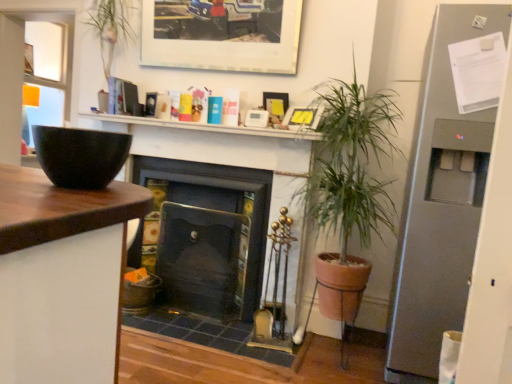
This screenshot has width=512, height=384. Describe the element at coordinates (303, 117) in the screenshot. I see `yellow paper picture frame at upper center, positioned as the 1th picture frame in bottom-to-top order` at that location.

Where is `satin silver fridge at right`? satin silver fridge at right is located at coordinates (441, 202).

Locate an element on the screen. matte white picture frame at upper center, which is counted as the 1th picture frame, starting from the top is located at coordinates (221, 36).

Between point (291, 304) and point (316, 133), which one is positioned behind?

The point (291, 304) is farther from the camera.

Is white matte shelf at upper center at the back of dark gray stone fireplace at center, arranged as the second fireplace when viewed from the left?

No, dark gray stone fireplace at center, arranged as the second fireplace when viewed from the left, is not facing away from white matte shelf at upper center.

Is dark gray stone fireplace at center, which is counted as the first fireplace, starting from the right, taller than white matte shelf at upper center?

Indeed, dark gray stone fireplace at center, which is counted as the first fireplace, starting from the right, has a greater height compared to white matte shelf at upper center.

From the image's perspective, is dark gray stone fireplace at center, which is counted as the first fireplace, starting from the right, positioned above or below white matte shelf at upper center?

Clearly, from the image's perspective, dark gray stone fireplace at center, which is counted as the first fireplace, starting from the right, is below white matte shelf at upper center.

Is satin silver fridge at right closer to camera compared to yellow paper picture frame at upper center, positioned as the 1th picture frame in bottom-to-top order?

Yes, the depth of satin silver fridge at right is less than that of yellow paper picture frame at upper center, positioned as the 1th picture frame in bottom-to-top order.

Considering the points (441, 286) and (297, 117), which point is in front, point (441, 286) or point (297, 117)?

The point (441, 286) is closer.

This screenshot has height=384, width=512. Find the location of `houseplant lying below the white matte shelf at upper center (from the image's perspective)`. houseplant lying below the white matte shelf at upper center (from the image's perspective) is located at coordinates (350, 163).

Which of these two, green leafy plant at center or white matte shelf at upper center, is smaller?

With smaller size is white matte shelf at upper center.

Is green leafy plant at center to the right of white matte shelf at upper center from the viewer's perspective?

Indeed, green leafy plant at center is positioned on the right side of white matte shelf at upper center.

Is white matte shelf at upper center at the back of green leafy plant at center?

No.

In the scene shown: Considering the relative sizes of matte black fireplace at center, positioned as the first fireplace in left-to-right order, and matte black bowl at left in the image provided, is matte black fireplace at center, positioned as the first fireplace in left-to-right order, taller than matte black bowl at left?

Yes, matte black fireplace at center, positioned as the first fireplace in left-to-right order, is taller than matte black bowl at left.

From the image's perspective, who appears lower, matte black fireplace at center, the 2th fireplace viewed from the right, or matte black bowl at left?

matte black fireplace at center, the 2th fireplace viewed from the right, appears lower in the image.

Are matte black fireplace at center, the 2th fireplace viewed from the right, and matte black bowl at left located far from each other?

matte black fireplace at center, the 2th fireplace viewed from the right, is positioned a significant distance from matte black bowl at left.

From the picture: Can you confirm if white matte shelf at upper center is positioned to the right of yellow paper picture frame at upper center, arranged as the 3th picture frame when viewed from the top?

In fact, white matte shelf at upper center is to the left of yellow paper picture frame at upper center, arranged as the 3th picture frame when viewed from the top.

From the image's perspective, is white matte shelf at upper center positioned above or below yellow paper picture frame at upper center, positioned as the 1th picture frame in bottom-to-top order?

Clearly, from the image's perspective, white matte shelf at upper center is below yellow paper picture frame at upper center, positioned as the 1th picture frame in bottom-to-top order.

Is white matte shelf at upper center not within yellow paper picture frame at upper center, arranged as the 3th picture frame when viewed from the top?

Yes.

Based on the photo, considering the sizes of objects white matte shelf at upper center and yellow paper picture frame at upper center, arranged as the 3th picture frame when viewed from the top, in the image provided, who is wider, white matte shelf at upper center or yellow paper picture frame at upper center, arranged as the 3th picture frame when viewed from the top,?

white matte shelf at upper center is wider.

Between satin silver fridge at right and matte black bowl at left, which one has larger size?

Bigger between the two is satin silver fridge at right.

From a real-world perspective, between satin silver fridge at right and matte black bowl at left, who is vertically lower?

satin silver fridge at right is physically lower.

Is satin silver fridge at right facing away from matte black bowl at left?

That's not correct — satin silver fridge at right is not looking away from matte black bowl at left.

Is satin silver fridge at right positioned before matte black bowl at left?

No, it is not.

From a real-world perspective, is matte black fireplace at center, the 2th fireplace viewed from the right, located higher than matte white picture frame at upper center, which is counted as the 1th picture frame, starting from the top?

No.

How different are the orientations of matte black fireplace at center, the 2th fireplace viewed from the right, and matte white picture frame at upper center, placed as the third picture frame when sorted from bottom to top, in degrees?

0.193 degrees.

Does matte black fireplace at center, positioned as the first fireplace in left-to-right order, have a lesser height compared to matte white picture frame at upper center, placed as the third picture frame when sorted from bottom to top?

No.

Could you tell me if matte black fireplace at center, positioned as the first fireplace in left-to-right order, is facing matte white picture frame at upper center, placed as the third picture frame when sorted from bottom to top?

No, matte black fireplace at center, positioned as the first fireplace in left-to-right order, is not turned towards matte white picture frame at upper center, placed as the third picture frame when sorted from bottom to top.

I want to click on shelf above the dark gray stone fireplace at center, which is counted as the first fireplace, starting from the right (from a real-world perspective), so click(x=205, y=127).

Where is `fridge below the yellow paper picture frame at upper center, positioned as the 1th picture frame in bottom-to-top order (from the image's perspective)`? The width and height of the screenshot is (512, 384). fridge below the yellow paper picture frame at upper center, positioned as the 1th picture frame in bottom-to-top order (from the image's perspective) is located at coordinates (441, 202).

Based on their spatial positions, is matte yellow picture frame at upper center, which is counted as the 2th picture frame, starting from the bottom, or matte white picture frame at upper center, placed as the third picture frame when sorted from bottom to top, closer to white matte shelf at upper center?

matte yellow picture frame at upper center, which is counted as the 2th picture frame, starting from the bottom, is closer to white matte shelf at upper center.

Considering their positions, is yellow paper picture frame at upper center, positioned as the 1th picture frame in bottom-to-top order, positioned closer to matte black bowl at left than matte white picture frame at upper center, which is counted as the 1th picture frame, starting from the top?

The object closer to matte black bowl at left is yellow paper picture frame at upper center, positioned as the 1th picture frame in bottom-to-top order.

Which object lies nearer to the anchor point matte black bowl at left, white matte shelf at upper center or dark gray stone fireplace at center, which is counted as the first fireplace, starting from the right?

white matte shelf at upper center is positioned closer to the anchor matte black bowl at left.

Considering their positions, is satin silver fridge at right positioned closer to matte black bowl at left than dark gray stone fireplace at center, arranged as the second fireplace when viewed from the left?

satin silver fridge at right is closer to matte black bowl at left.

Estimate the real-world distances between objects in this image. Which object is closer to satin silver fridge at right, white matte shelf at upper center or matte yellow picture frame at upper center, which is counted as the 2th picture frame, starting from the bottom?

white matte shelf at upper center is positioned closer to the anchor satin silver fridge at right.

Looking at the image, which one is located closer to satin silver fridge at right, matte black bowl at left or yellow paper picture frame at upper center, arranged as the 3th picture frame when viewed from the top?

Based on the image, yellow paper picture frame at upper center, arranged as the 3th picture frame when viewed from the top, appears to be nearer to satin silver fridge at right.

From the image, which object appears to be farther from matte black fireplace at center, the 2th fireplace viewed from the right, matte white picture frame at upper center, placed as the third picture frame when sorted from bottom to top, or matte yellow picture frame at upper center, which is counted as the second picture frame, starting from the top?

matte white picture frame at upper center, placed as the third picture frame when sorted from bottom to top, lies further to matte black fireplace at center, the 2th fireplace viewed from the right, than the other object.

Looking at this image, based on their spatial positions, is matte white picture frame at upper center, which is counted as the 1th picture frame, starting from the top, or matte black bowl at left closer to dark gray stone fireplace at center, which is counted as the first fireplace, starting from the right?

matte white picture frame at upper center, which is counted as the 1th picture frame, starting from the top, is positioned closer to the anchor dark gray stone fireplace at center, which is counted as the first fireplace, starting from the right.

Identify the location of fireplace situated between matte black fireplace at center, positioned as the first fireplace in left-to-right order, and satin silver fridge at right from left to right. This screenshot has width=512, height=384. (212, 196).

Find the location of a particular element. This screenshot has height=384, width=512. houseplant situated between matte yellow picture frame at upper center, which is counted as the 2th picture frame, starting from the bottom, and satin silver fridge at right from left to right is located at coordinates (350, 163).

Locate an element on the screen. This screenshot has height=384, width=512. houseplant between matte black bowl at left and white matte shelf at upper center from front to back is located at coordinates (350, 163).

In order to click on fireplace between matte yellow picture frame at upper center, which is counted as the 2th picture frame, starting from the bottom, and matte black fireplace at center, the 2th fireplace viewed from the right, in the vertical direction in this screenshot , I will do `click(212, 196)`.